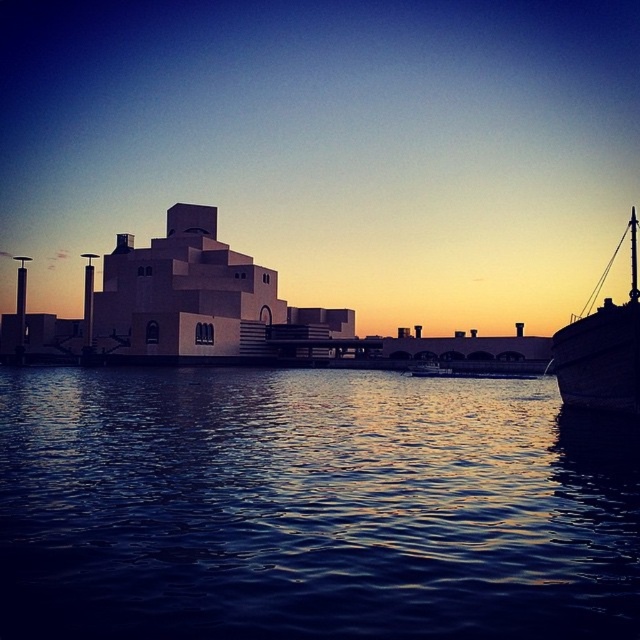
Which is more to the left, dark blue liquid at center or wooden ship at right?

dark blue liquid at center is more to the left.

Which is more to the right, dark blue liquid at center or wooden ship at right?

Positioned to the right is wooden ship at right.

Is point (77, 628) positioned before point (634, 321)?

Yes, it is.

Where is `dark blue liquid at center`? This screenshot has width=640, height=640. dark blue liquid at center is located at coordinates (310, 506).